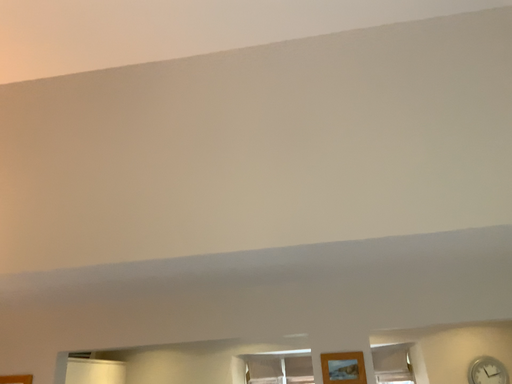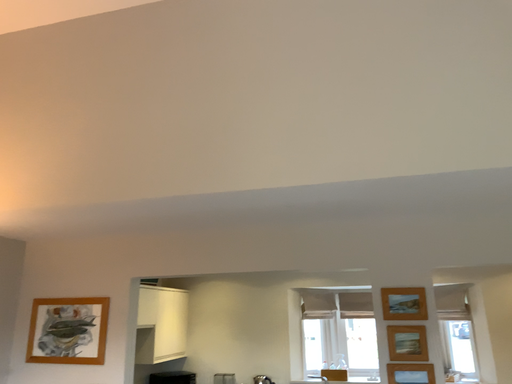
Question: How did the camera likely rotate when shooting the video?

Choices:
 (A) rotated right
 (B) rotated left

Answer: (B)